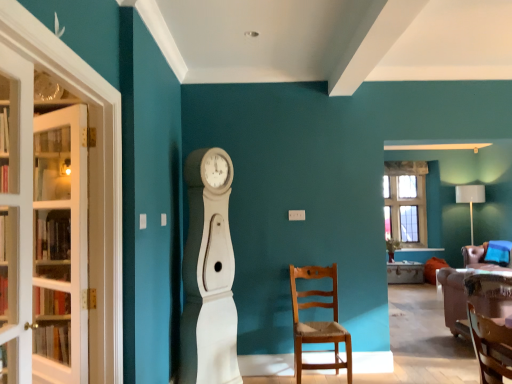
Locate an element on the screen. wooden chair at center, the 2th chair positioned from the left is located at coordinates (488, 255).

At what (x,y) coordinates should I click in order to perform the action: click on white glass door at left, the second door positioned from the front. Please return your answer as a coordinate pair (x, y). The width and height of the screenshot is (512, 384). Looking at the image, I should click on (60, 246).

This screenshot has height=384, width=512. Describe the element at coordinates (16, 217) in the screenshot. I see `white glass door at left, the 1th door viewed from the right` at that location.

Locate an element on the screen. The image size is (512, 384). wooden table at center is located at coordinates (405, 272).

Find the location of `clear glass window at upper right`. clear glass window at upper right is located at coordinates (406, 202).

The width and height of the screenshot is (512, 384). I want to click on clear glass cabinet at left, so click(x=88, y=179).

What are the coordinates of `wooden chair at center, the 1th chair viewed from the right` in the screenshot? It's located at (488, 255).

From a real-world perspective, relative to white glass door at left, acting as the second door starting from the left, is white wood clock at center vertically above or below?

white wood clock at center is below white glass door at left, acting as the second door starting from the left.

Is white wood clock at center looking in the opposite direction of white glass door at left, the 2th door when ordered from back to front?

No, white wood clock at center's orientation is not away from white glass door at left, the 2th door when ordered from back to front.

Is white wood clock at center not close to white glass door at left, acting as the second door starting from the left?

Yes, white wood clock at center and white glass door at left, acting as the second door starting from the left, are located far from each other.

Which object is thinner, white wood clock at center or white glass door at left, placed as the first door when sorted from front to back?

white glass door at left, placed as the first door when sorted from front to back, is thinner.

Can you confirm if clear glass cabinet at left is taller than wooden chair at center, positioned as the 2th chair in back-to-front order?

Yes.

The image size is (512, 384). Identify the location of glass door above the wooden chair at center, the 2th chair viewed from the right (from the image's perspective). (88, 179).

From a real-world perspective, which is physically below, clear glass cabinet at left or wooden chair at center, acting as the first chair starting from the front?

In real-world perspective, wooden chair at center, acting as the first chair starting from the front, is lower.

Is clear glass cabinet at left turned away from wooden chair at center, which is the first chair from left to right?

No.

Is clear glass cabinet at left with white glass door at left, the second door positioned from the right?

There is a gap between clear glass cabinet at left and white glass door at left, the second door positioned from the right.

Considering the relative sizes of clear glass cabinet at left and white glass door at left, the second door positioned from the right, in the image provided, is clear glass cabinet at left wider than white glass door at left, the second door positioned from the right,?

Yes.

Based on the photo, who is more distant, white glass door at left, the 2th door when ordered from back to front, or clear glass window at upper right?

clear glass window at upper right is further away from the camera.

Considering the points (31, 111) and (386, 205), which point is in front, point (31, 111) or point (386, 205)?

The point (31, 111) is closer to the camera.

This screenshot has width=512, height=384. What are the coordinates of `window on the right of white glass door at left, the 1th door viewed from the right` in the screenshot? It's located at (406, 202).

In the scene shown: Between white glass door at left, acting as the second door starting from the left, and clear glass window at upper right, which one has smaller width?

white glass door at left, acting as the second door starting from the left, is thinner.

Is wooden chair at center, the 2th chair positioned from the left, looking in the opposite direction of white wood clock at center?

No, wooden chair at center, the 2th chair positioned from the left, is not facing away from white wood clock at center.

Would you say white wood clock at center is part of wooden chair at center, the 2th chair positioned from the left,'s contents?

Actually, white wood clock at center is outside wooden chair at center, the 2th chair positioned from the left.

Considering the sizes of objects wooden chair at center, the 1th chair viewed from the right, and white wood clock at center in the image provided, who is wider, wooden chair at center, the 1th chair viewed from the right, or white wood clock at center?

With larger width is wooden chair at center, the 1th chair viewed from the right.

Consider the image. Considering the relative positions of wooden chair at center, the 2th chair positioned from the left, and white wood clock at center in the image provided, is wooden chair at center, the 2th chair positioned from the left, to the right of white wood clock at center from the viewer's perspective?

Yes.

In the image, is wooden table at center positioned in front of or behind velvet brown sofa at lower right?

Visually, wooden table at center is located behind velvet brown sofa at lower right.

From a real-world perspective, which is physically above, wooden table at center or velvet brown sofa at lower right?

velvet brown sofa at lower right.

Could you tell me if wooden table at center is turned towards velvet brown sofa at lower right?

Yes.

Is point (295, 327) closer or farther from the camera than point (503, 311)?

Point (295, 327) appears to be closer to the viewer than point (503, 311).

The height and width of the screenshot is (384, 512). What are the coordinates of `studio couch behind the wooden chair at center, which is the first chair from left to right` in the screenshot? It's located at (468, 300).

Can you confirm if wooden chair at center, which is the first chair from left to right, is positioned to the right of velvet brown sofa at lower right?

No, wooden chair at center, which is the first chair from left to right, is not to the right of velvet brown sofa at lower right.

From the image's perspective, between wooden chair at center, which is the first chair from left to right, and velvet brown sofa at lower right, who is located below?

velvet brown sofa at lower right.

Where is `the 2nd door located above the white wood clock at center (from a real-world perspective)`? This screenshot has height=384, width=512. the 2nd door located above the white wood clock at center (from a real-world perspective) is located at coordinates (16, 217).

Where is `glass door located in front of the wooden chair at center, the 2th chair viewed from the right`? glass door located in front of the wooden chair at center, the 2th chair viewed from the right is located at coordinates (88, 179).

When comparing their distances from wooden table at center, does clear glass window at upper right or white glass door at left, which is the first door from left to right, seem further?

The object further to wooden table at center is white glass door at left, which is the first door from left to right.

From the image, which object appears to be farther from wooden table at center, clear glass cabinet at left or white glass door at left, acting as the second door starting from the left?

The object further to wooden table at center is white glass door at left, acting as the second door starting from the left.

Estimate the real-world distances between objects in this image. Which object is further from clear glass window at upper right, velvet brown sofa at lower right or wooden chair at center, acting as the first chair starting from the front?

wooden chair at center, acting as the first chair starting from the front, is positioned further to the anchor clear glass window at upper right.

Considering their positions, is wooden chair at center, arranged as the first chair when viewed from the back, positioned further to clear glass cabinet at left than wooden table at center?

wooden table at center is further to clear glass cabinet at left.

Estimate the real-world distances between objects in this image. Which object is further from white glass door at left, the second door positioned from the right, white glass door at left, the 2th door when ordered from back to front, or wooden chair at center, acting as the first chair starting from the front?

wooden chair at center, acting as the first chair starting from the front, is further to white glass door at left, the second door positioned from the right.

Considering their positions, is wooden chair at center, positioned as the 2th chair in back-to-front order, positioned closer to white wood clock at center than velvet brown sofa at lower right?

wooden chair at center, positioned as the 2th chair in back-to-front order, lies closer to white wood clock at center than the other object.

Considering their positions, is clear glass window at upper right positioned further to white wood clock at center than velvet brown sofa at lower right?

Among the two, clear glass window at upper right is located further to white wood clock at center.

Looking at the image, which one is located closer to wooden chair at center, the 1th chair viewed from the right, clear glass cabinet at left or white wood clock at center?

white wood clock at center lies closer to wooden chair at center, the 1th chair viewed from the right, than the other object.

Identify the location of door between white glass door at left, the 2th door when ordered from back to front, and white wood clock at center, along the z-axis. (60, 246).

Where is `chair located between wooden chair at center, acting as the first chair starting from the front, and clear glass window at upper right in the depth direction`? chair located between wooden chair at center, acting as the first chair starting from the front, and clear glass window at upper right in the depth direction is located at coordinates (488, 255).

Where is `studio couch between wooden chair at center, positioned as the 2th chair in back-to-front order, and clear glass window at upper right in the front-back direction`? The image size is (512, 384). studio couch between wooden chair at center, positioned as the 2th chair in back-to-front order, and clear glass window at upper right in the front-back direction is located at coordinates (468, 300).

Where is `studio couch between white glass door at left, acting as the second door starting from the left, and wooden chair at center, the 2th chair positioned from the left, along the z-axis`? Image resolution: width=512 pixels, height=384 pixels. studio couch between white glass door at left, acting as the second door starting from the left, and wooden chair at center, the 2th chair positioned from the left, along the z-axis is located at coordinates pos(468,300).